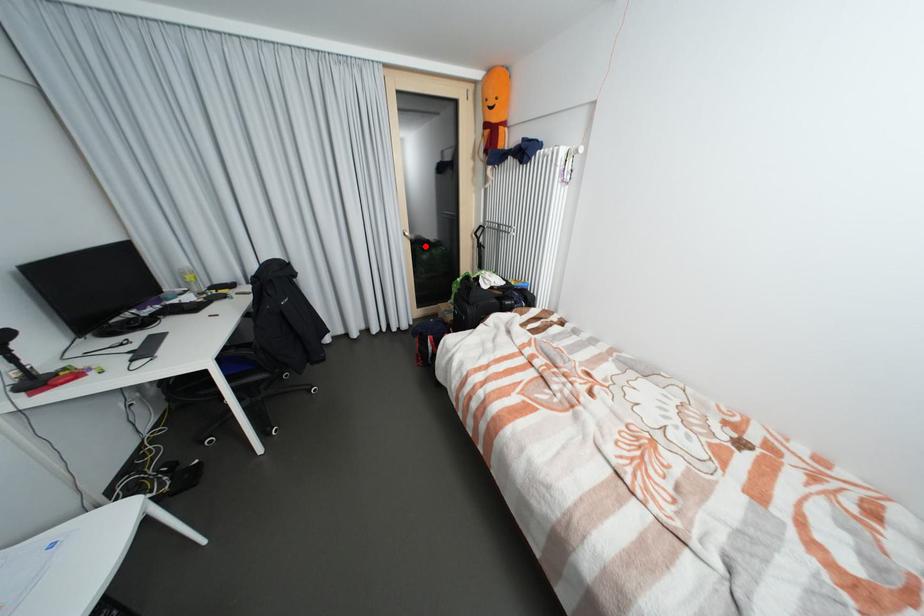
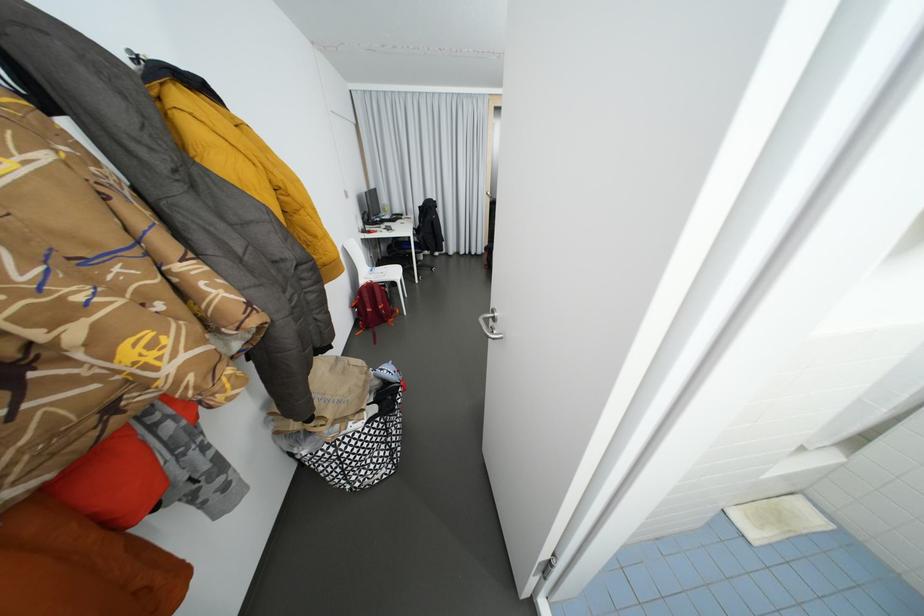
Question: I am providing you with two images of the same scene from different viewpoints. A red point is marked on the first image. Can you still see the location of the red point in image 2?

Choices:
 (A) Yes
 (B) No

Answer: (B)